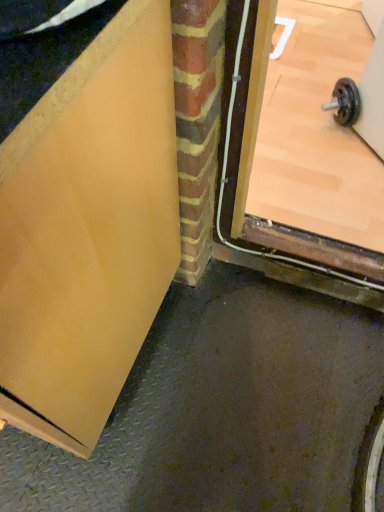
Find the location of a particular element. The width and height of the screenshot is (384, 512). free spot above matte wood door at center, the 2th door when ordered from left to right (from a real-world perspective) is located at coordinates (315, 87).